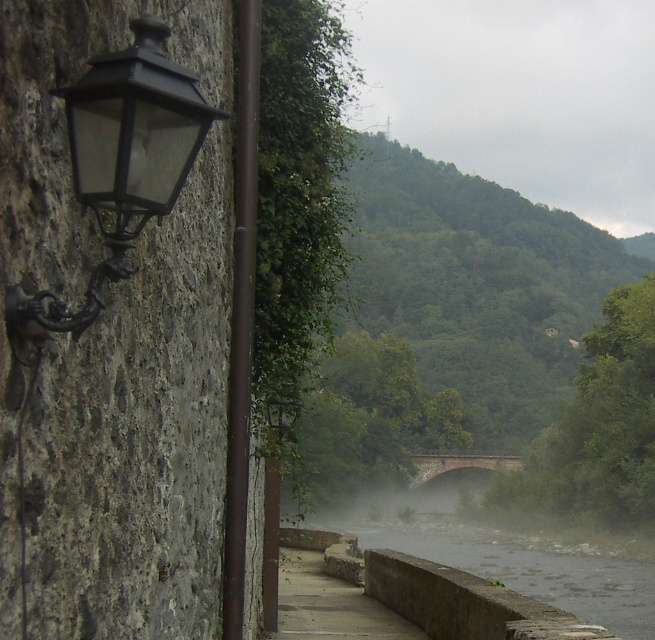
You are an interior designer planning to place a new decorative item in the riverside area. You have the matte black lantern at left and the red brick bridge at center. Based on their sizes, which object would be more suitable for a smaller garden space?

The matte black lantern at left occupies less space than the red brick bridge at center, so it would be more suitable for a smaller garden space.

You are standing at the riverside and looking at the scene. There are two points marked in the image. The first point is at coordinate point (x=98, y=221) and the second is at coordinate point (x=498, y=465). Which point appears closer to you?

Point (x=98, y=221) is closer to the camera than point (x=498, y=465), so the first point is closer to you.

Based on the photo, you are an architect designing a new riverside pathway. You need to place a bench between the matte black lantern at left and the red brick bridge at center. Which object should the bench be closer to if it needs to be placed near the thinner structure?

The bench should be placed closer to the matte black lantern at left since it is thinner than the red brick bridge at center.